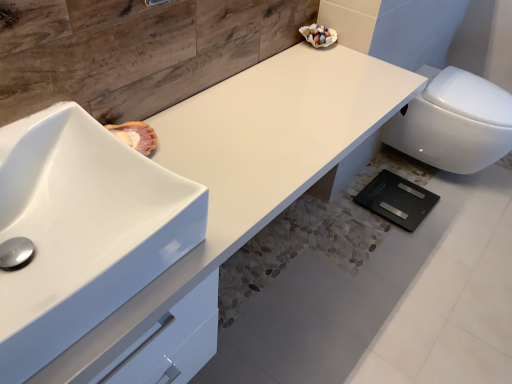
Question: Is white glossy sink at left placed right next to white glossy counter top at center?

Choices:
 (A) yes
 (B) no

Answer: (B)

Question: Does white glossy sink at left appear on the left side of white glossy counter top at center?

Choices:
 (A) no
 (B) yes

Answer: (B)

Question: Considering the relative sizes of white glossy sink at left and white glossy counter top at center in the image provided, is white glossy sink at left wider than white glossy counter top at center?

Choices:
 (A) yes
 (B) no

Answer: (B)

Question: Is white glossy sink at left bigger than white glossy counter top at center?

Choices:
 (A) yes
 (B) no

Answer: (B)

Question: Is white glossy sink at left looking in the opposite direction of white glossy counter top at center?

Choices:
 (A) no
 (B) yes

Answer: (A)

Question: Considering the positions of white glossy counter top at center and white glossy sink at left in the image, is white glossy counter top at center bigger or smaller than white glossy sink at left?

Choices:
 (A) small
 (B) big

Answer: (B)

Question: Is white glossy counter top at center spatially inside white glossy sink at left, or outside of it?

Choices:
 (A) outside
 (B) inside

Answer: (A)

Question: From a real-world perspective, relative to white glossy sink at left, is white glossy counter top at center vertically above or below?

Choices:
 (A) above
 (B) below

Answer: (B)

Question: From the image's perspective, is white glossy counter top at center located above or below white glossy sink at left?

Choices:
 (A) below
 (B) above

Answer: (B)

Question: Considering the positions of white glossy toilet at lower right and white glossy counter top at center in the image, is white glossy toilet at lower right bigger or smaller than white glossy counter top at center?

Choices:
 (A) big
 (B) small

Answer: (B)

Question: Is white glossy toilet at lower right wider or thinner than white glossy counter top at center?

Choices:
 (A) wide
 (B) thin

Answer: (A)

Question: Choose the correct answer: Is white glossy toilet at lower right inside white glossy counter top at center or outside it?

Choices:
 (A) inside
 (B) outside

Answer: (B)

Question: From the image's perspective, is white glossy toilet at lower right positioned above or below white glossy counter top at center?

Choices:
 (A) below
 (B) above

Answer: (B)

Question: Would you say white glossy counter top at center is to the left or to the right of white glossy toilet at lower right in the picture?

Choices:
 (A) right
 (B) left

Answer: (B)

Question: From a real-world perspective, is white glossy counter top at center physically located above or below white glossy toilet at lower right?

Choices:
 (A) above
 (B) below

Answer: (A)